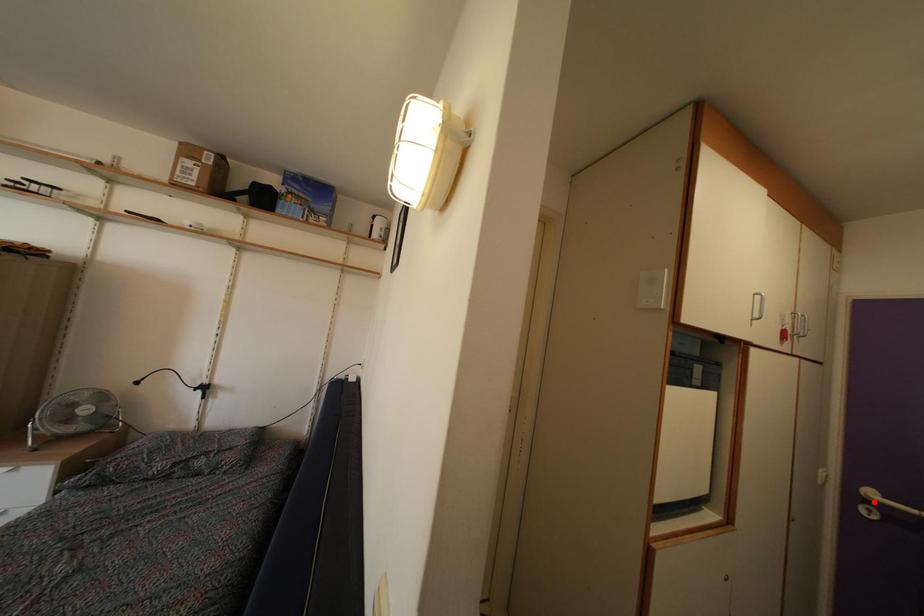
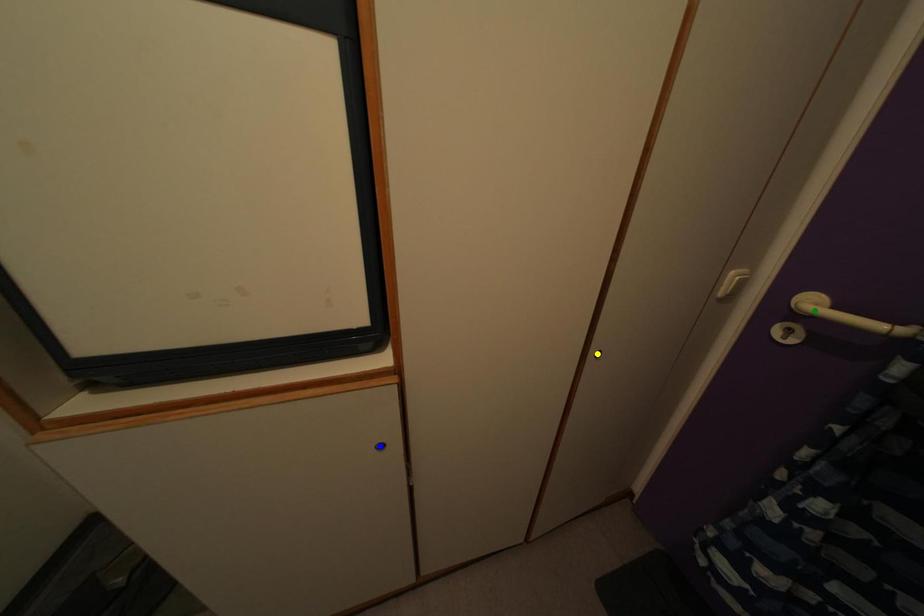
Question: I am providing you with two images of the same scene from different viewpoints. A red point is marked on the first image. You are given multiple points on the second image. Which spot in image 2 lines up with the point in image 1?

Choices:
 (A) green point
 (B) yellow point
 (C) blue point

Answer: (A)